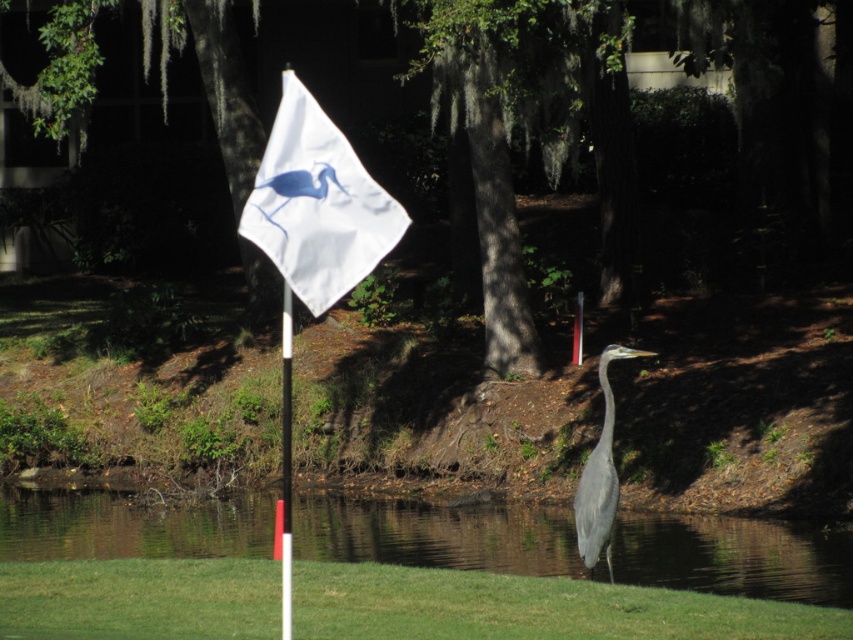
Question: Estimate the real-world distances between objects in this image. Which object is closer to the black glossy flag pole at center?

Choices:
 (A) white fabric flag at center
 (B) gray matte bird at center

Answer: (B)

Question: Does transparent water at lower center come in front of white fabric flag at center?

Choices:
 (A) no
 (B) yes

Answer: (A)

Question: From the image, what is the correct spatial relationship of green grass at lower right in relation to gray matte bird at center?

Choices:
 (A) right
 (B) left

Answer: (B)

Question: Does black glossy flag pole at center have a greater width compared to white plastic flag pole at center?

Choices:
 (A) no
 (B) yes

Answer: (A)

Question: Considering the real-world distances, which object is farthest from the gray matte bird at center?

Choices:
 (A) green grass at lower right
 (B) transparent water at lower center

Answer: (B)

Question: Which object is the closest to the white fabric flag at center?

Choices:
 (A) green grass at lower right
 (B) gray matte bird at center
 (C) transparent water at lower center
 (D) white plastic flag pole at center

Answer: (A)